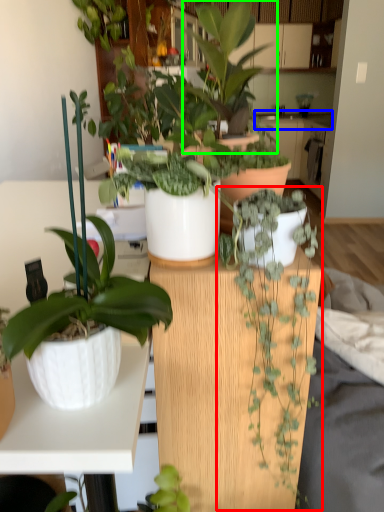
Question: Considering the real-world distances, which object is closest to houseplant (highlighted by a red box)? counter top (highlighted by a blue box) or houseplant (highlighted by a green box).

Choices:
 (A) counter top
 (B) houseplant

Answer: (B)